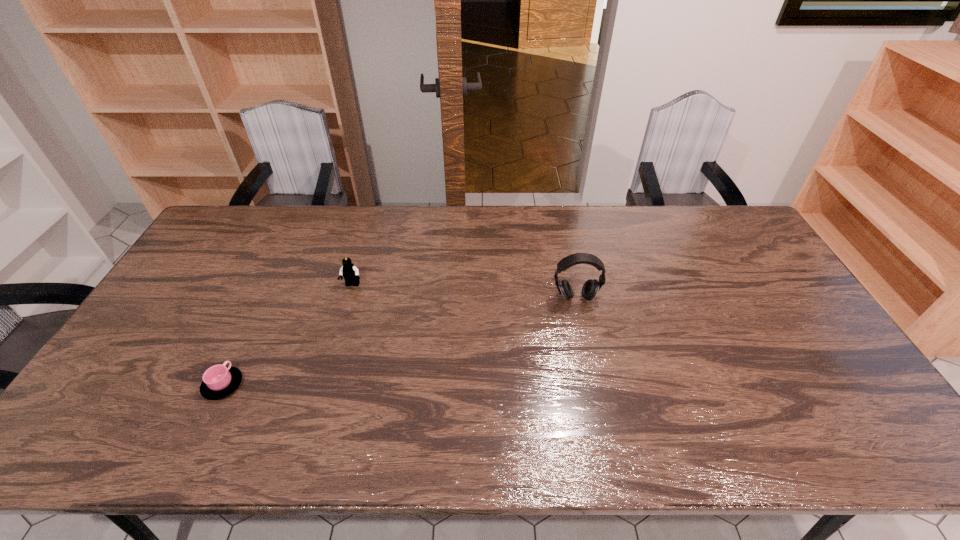
Image resolution: width=960 pixels, height=540 pixels. Find the location of `free spot located on the side with the handle of the shortest object`. free spot located on the side with the handle of the shortest object is located at coordinates (264, 299).

In the image, there is a desktop. Where is `free space at the far edge`? Image resolution: width=960 pixels, height=540 pixels. free space at the far edge is located at coordinates (612, 219).

At what (x,y) coordinates should I click in order to perform the action: click on free space at the near edge of the desktop. Please return your answer as a coordinate pair (x, y). This screenshot has width=960, height=540. Looking at the image, I should click on (194, 426).

In the image, there is a desktop. Identify the location of vacant space at the left edge. The image size is (960, 540). (157, 391).

In the image, there is a desktop. Find the location of `free space at the right edge`. free space at the right edge is located at coordinates (763, 296).

Find the location of `free space at the far left corner`. free space at the far left corner is located at coordinates (221, 226).

Where is `free spot between the tallest object and the second tallest object`? free spot between the tallest object and the second tallest object is located at coordinates point(464,292).

The width and height of the screenshot is (960, 540). I want to click on free spot between the nearest object and the tallest object, so click(x=399, y=341).

The width and height of the screenshot is (960, 540). I want to click on unoccupied position between the second tallest object and the leftmost object, so click(x=288, y=335).

This screenshot has width=960, height=540. Identify the location of free space between the Lego and the shortest object. tap(288, 335).